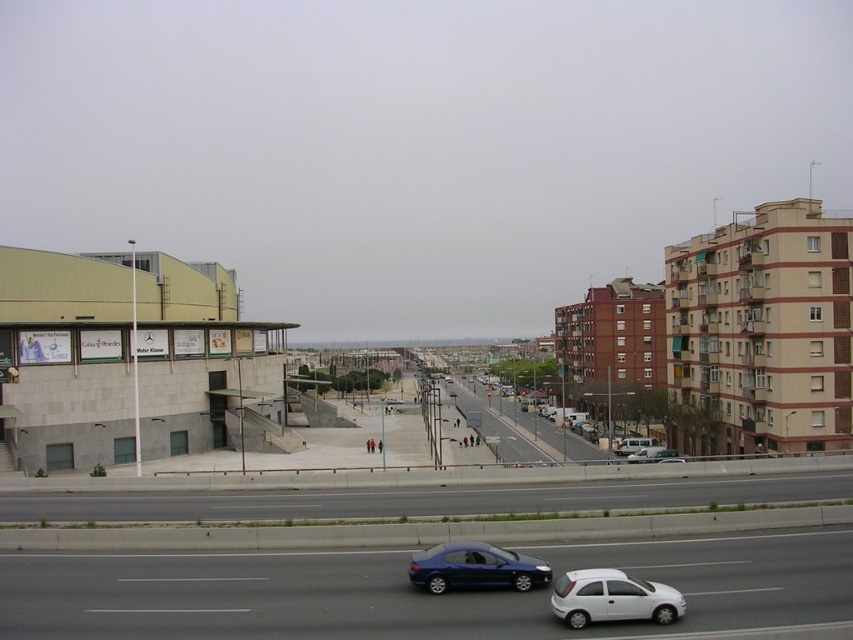
You are a delivery person who needs to place a large package on the asphalt road at lower center. The package is taller than the matte blue sedan at center. Will the package fit on the road without exceeding its height limit?

The asphalt road at lower center has a greater height compared to the matte blue sedan at center. Since the package is taller than the sedan, it may exceed the road height limit, so it might not fit.